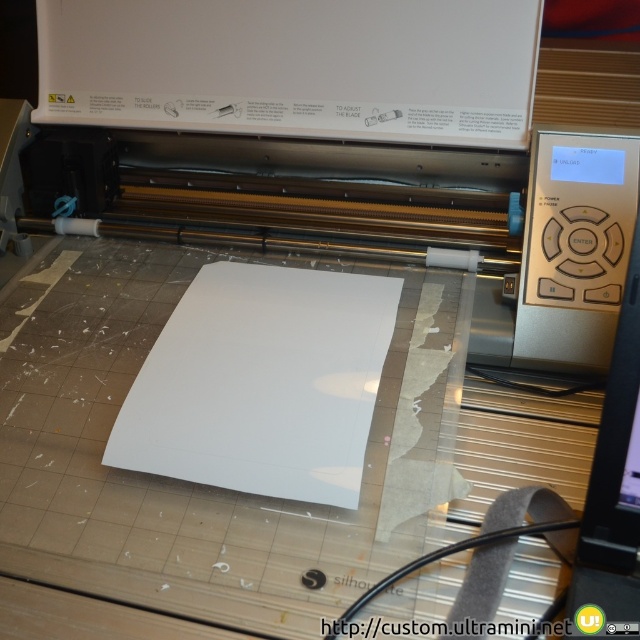
You are setting up a Silhouette Cameo cutting machine and need to ensure proper alignment between the metallic silver printer at center and the white matte paper at center. According to the manufacturer guidelines, the distance between them should be exactly 8 inches. Is the current setup within the acceptable range?

The metallic silver printer at center is 7.98 inches from the white matte paper at center, which is within the acceptable range as it is just 0.02 inches less than the required 8 inches.

You are setting up a new Silhouette Cameo cutting machine and need to ensure proper alignment between the metallic silver printer at center and the white matte paper at center. Given their relative sizes, which object should be placed first to ensure the other fits correctly?

The metallic silver printer at center is taller than the white matte paper at center, so you should place the white matte paper at center first, ensuring it fits within the space allocated for the taller printer.

You are an operator who needs to access the control panel on the right side of the metallic silver printer at center. However, the white matte paper at center is blocking your view. Can you move the paper to the left to clear the view?

The white matte paper at center is behind the metallic silver printer at center, so moving it to the left would require lifting it over the printer. Since the paper is positioned centrally, moving it left might allow you to see the control panel on the right side of the printer.